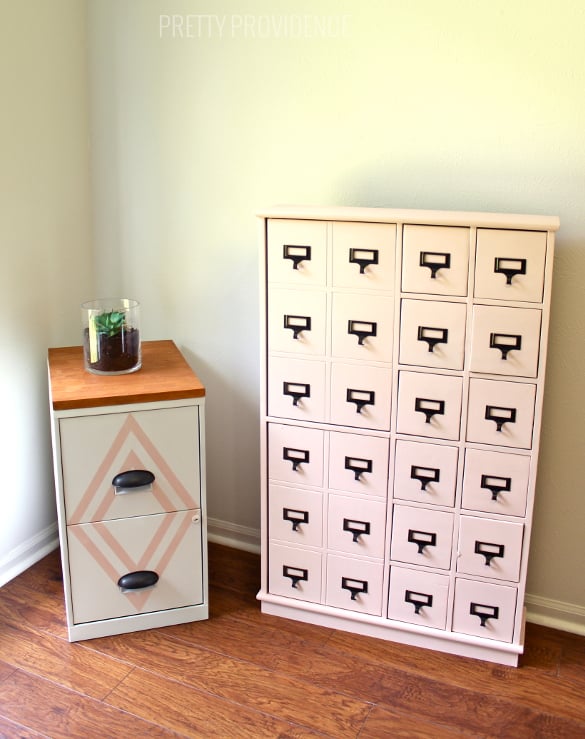
Where is `lock on cabinet`? lock on cabinet is located at coordinates (196, 516).